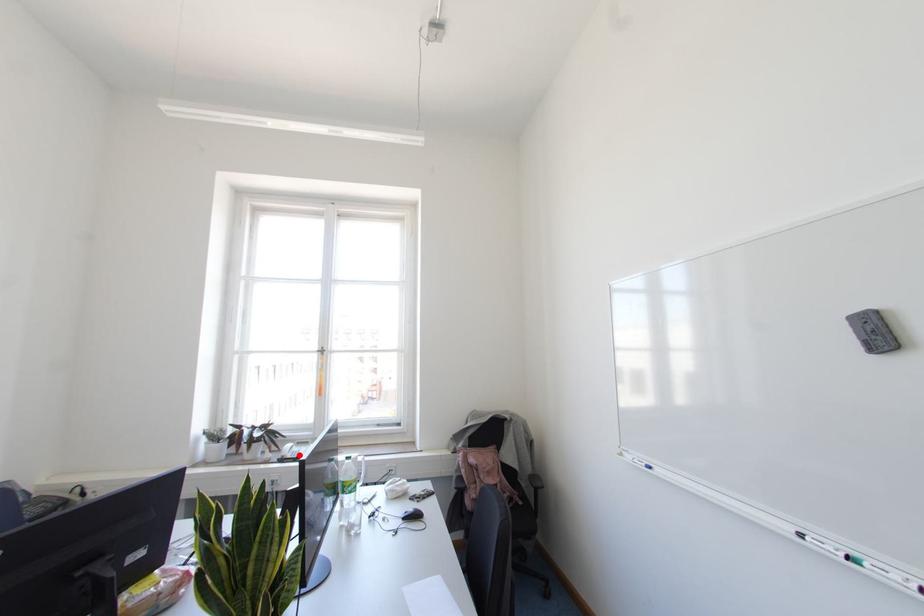
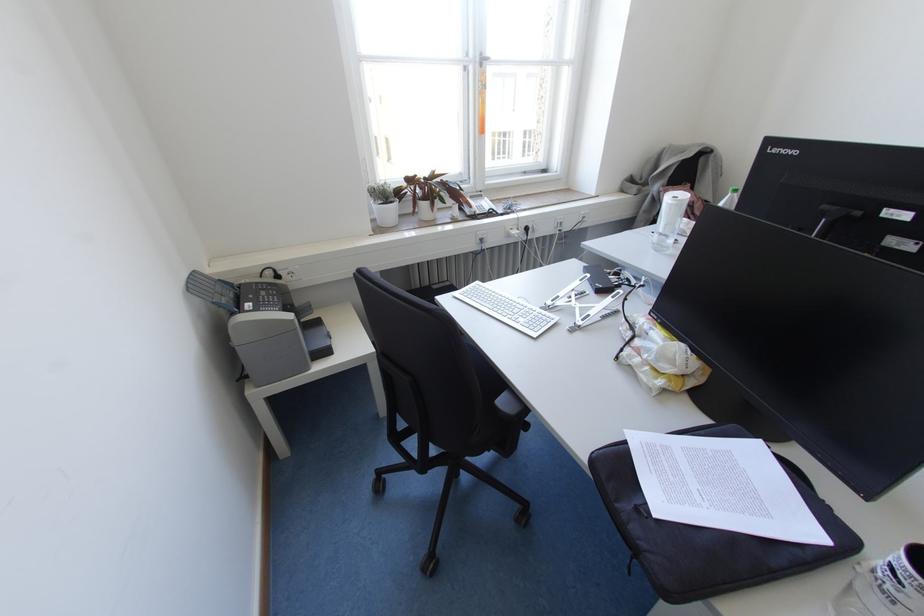
Question: I am providing you with two images of the same scene from different viewpoints. A red point is shown in image1. For the corresponding object point in image2, is it positioned nearer or farther from the camera?

Choices:
 (A) Nearer
 (B) Farther

Answer: (A)